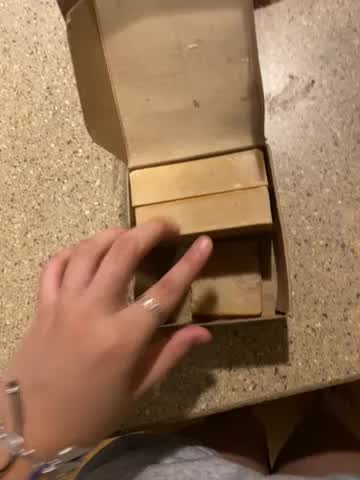
The height and width of the screenshot is (480, 360). I want to click on granite countertop, so click(x=334, y=340).